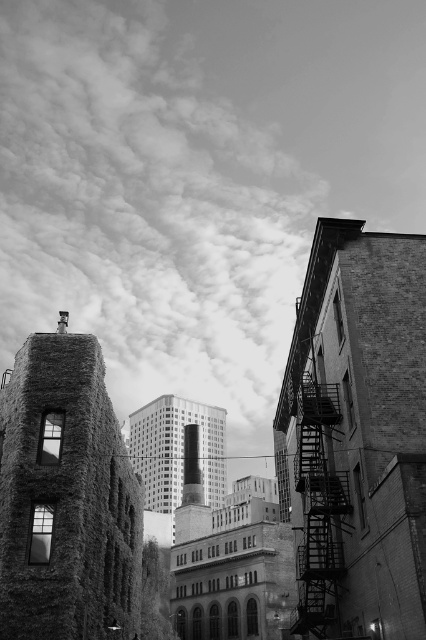
Does brick wall at right appear under metallic fire escape at right?

Yes.

Is point (394, 576) positioned behind point (305, 456)?

No, it is in front of (305, 456).

Identify the location of brick wall at right. (356, 436).

Is cloudy sky at upper center shorter than metallic fire escape at right?

Incorrect, cloudy sky at upper center's height does not fall short of metallic fire escape at right's.

Is cloudy sky at upper center behind metallic fire escape at right?

Yes, cloudy sky at upper center is behind metallic fire escape at right.

What do you see at coordinates (147, 202) in the screenshot? I see `cloudy sky at upper center` at bounding box center [147, 202].

The width and height of the screenshot is (426, 640). What are the coordinates of `cloudy sky at upper center` in the screenshot? It's located at (147, 202).

Which is above, cloudy sky at upper center or rustic stone tower at left?

cloudy sky at upper center is above.

Can you confirm if cloudy sky at upper center is positioned below rustic stone tower at left?

Incorrect, cloudy sky at upper center is not positioned below rustic stone tower at left.

Is point (127, 378) in front of point (83, 428)?

No, (127, 378) is further to viewer.

Identify the location of cloudy sky at upper center. (147, 202).